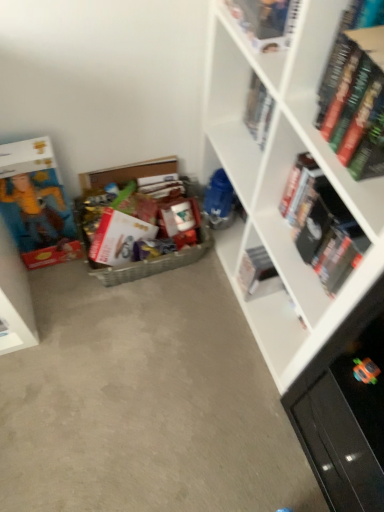
Locate an element on the screen. vacant space in front of multicolored cardboard box at center, acting as the 1th book starting from the left is located at coordinates (143, 323).